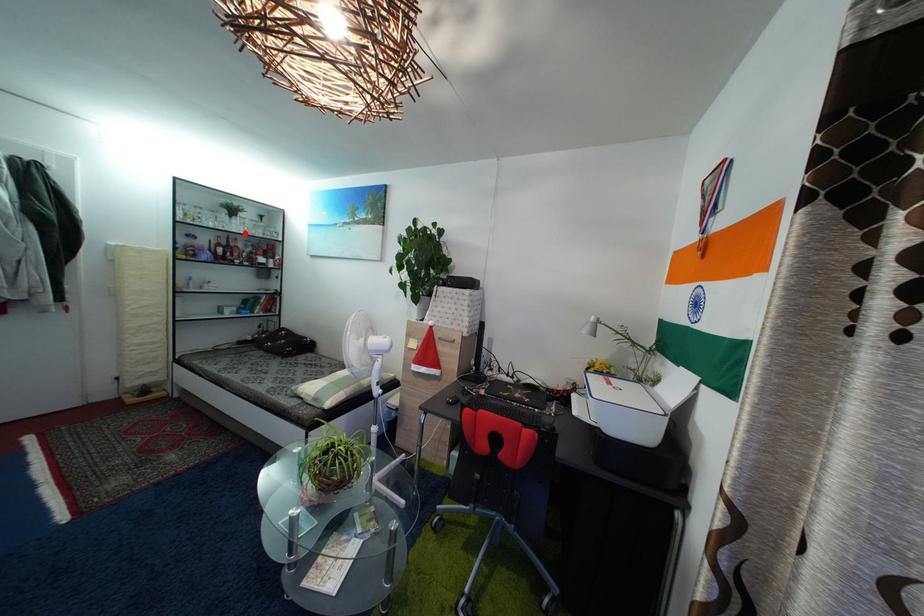
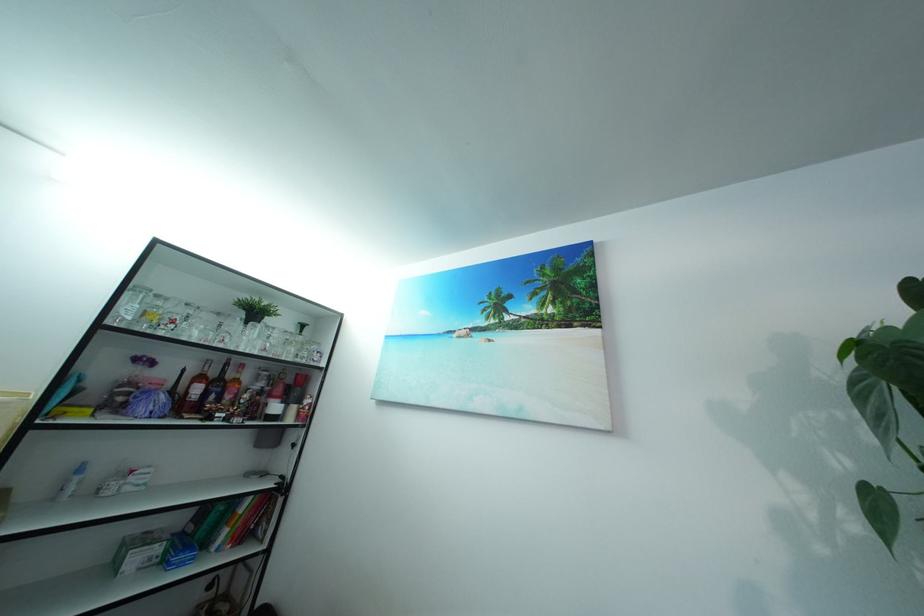
Locate, in the second image, the point that corresponds to the highlighted location in the first image.

(257, 347)